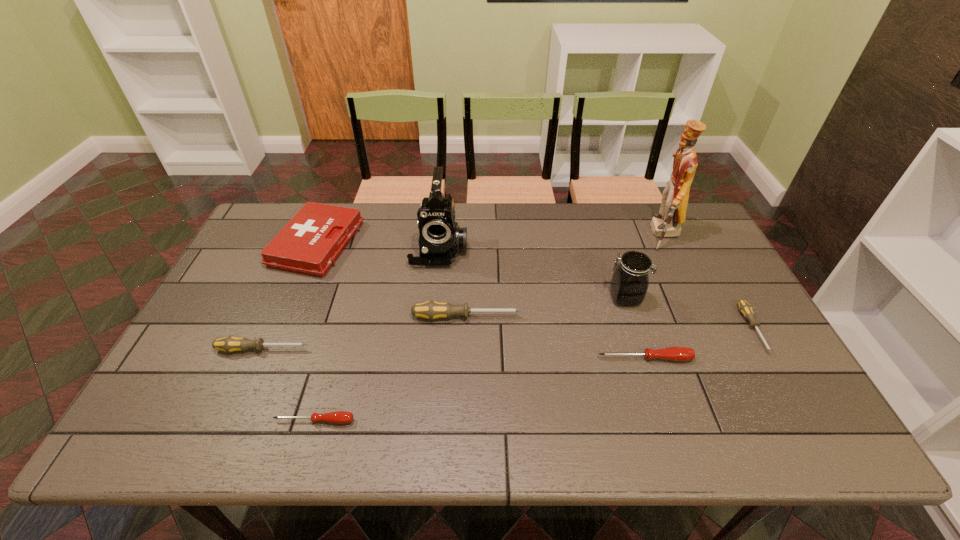
You are a GUI agent. You are given a task and a screenshot of the screen. Output one action in this format:
    pyautogui.click(x=<x>, y=<y>)
    Task: Click on the object present at the near edge
    The image size is (960, 540).
    Given the screenshot: What is the action you would take?
    pyautogui.click(x=339, y=417)

Find the location of `the first-aid kit located at the left edge`. the first-aid kit located at the left edge is located at coordinates (310, 243).

What are the coordinates of `screwdriver at the left edge` in the screenshot? It's located at (230, 344).

You are a GUI agent. You are given a task and a screenshot of the screen. Output one action in this format:
    pyautogui.click(x=<x>, y=<y>)
    Task: Click on the nutcracker present at the right edge
    
    Given the screenshot: What is the action you would take?
    pos(667,223)

The height and width of the screenshot is (540, 960). I want to click on screwdriver that is positioned at the right edge, so click(746, 309).

Where is `object that is at the far left corner`? The width and height of the screenshot is (960, 540). object that is at the far left corner is located at coordinates (310, 243).

This screenshot has height=540, width=960. I want to click on object situated at the far right corner, so click(x=667, y=223).

I want to click on free space at the far edge of the desktop, so click(x=371, y=218).

I want to click on vacant space at the left edge, so click(x=180, y=406).

In the image, there is a desktop. Where is `vacant region at the right edge`? The width and height of the screenshot is (960, 540). vacant region at the right edge is located at coordinates 701,255.